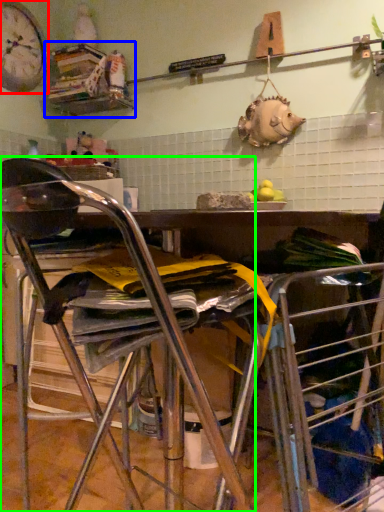
Question: Which object is positioned farthest from clock (highlighted by a red box)? Select from shelf (highlighted by a blue box) and chair (highlighted by a green box).

Choices:
 (A) shelf
 (B) chair

Answer: (B)